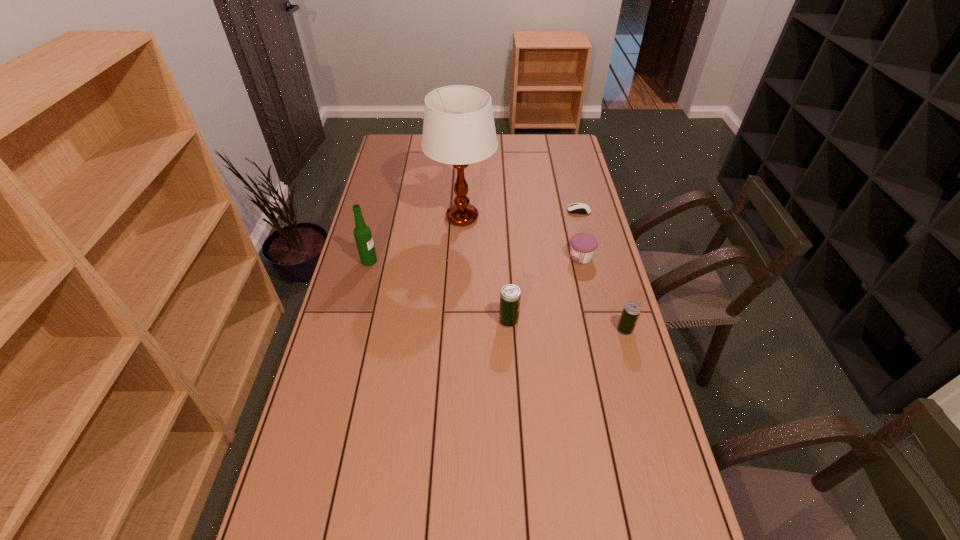
Where is `mouse located in the right edge section of the desktop`? mouse located in the right edge section of the desktop is located at coordinates (576, 208).

At what (x,y) coordinates should I click in order to perform the action: click on vacant space at the near edge. Please return your answer as a coordinate pair (x, y). This screenshot has height=540, width=960. Looking at the image, I should click on (464, 524).

Image resolution: width=960 pixels, height=540 pixels. Find the location of `vacant space at the left edge of the desktop`. vacant space at the left edge of the desktop is located at coordinates (393, 227).

In the image, there is a desktop. Find the location of `vacant area at the right edge`. vacant area at the right edge is located at coordinates (561, 182).

What are the coordinates of `free space at the far right corner` in the screenshot? It's located at (572, 154).

What are the coordinates of `vacant region between the mouse and the table lamp` in the screenshot? It's located at (520, 214).

Identify the location of vacant area between the third shortest object and the taller beer can. This screenshot has height=540, width=960. (566, 325).

You are a GUI agent. You are given a task and a screenshot of the screen. Output one action in this format:
    pyautogui.click(x=<x>, y=<y>)
    Task: Click on the vacant region between the shorter beer can and the beer bottle
    This screenshot has width=960, height=540.
    Given the screenshot: What is the action you would take?
    pyautogui.click(x=497, y=295)

Where is `unoccupied area between the beer bottle and the jam`? unoccupied area between the beer bottle and the jam is located at coordinates (475, 259).

Find the location of a particular element. The image size is (960, 540). vacant area between the shorter beer can and the shortest object is located at coordinates (602, 270).